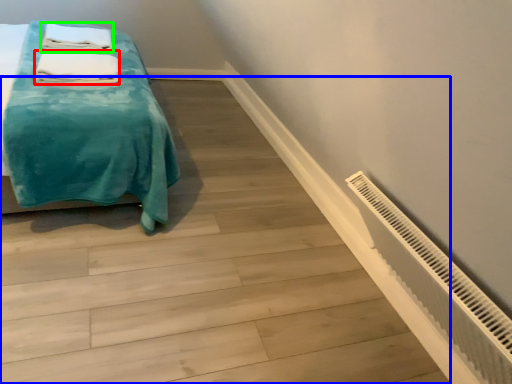
Question: Based on their relative distances, which object is farther from bath towel (highlighted by a red box)? Choose from stairwell (highlighted by a blue box) and bath towel (highlighted by a green box).

Choices:
 (A) stairwell
 (B) bath towel

Answer: (A)